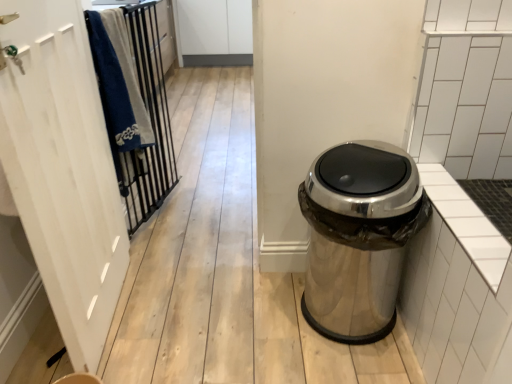
What is the approximate width of metallic black bars at left?

metallic black bars at left is 6.06 inches in width.

The width and height of the screenshot is (512, 384). What do you see at coordinates (134, 106) in the screenshot?
I see `metallic black bars at left` at bounding box center [134, 106].

Where is `white wood screen door at left`? white wood screen door at left is located at coordinates pos(63,170).

Is white wood screen door at left at the back of metallic black bars at left?

No, metallic black bars at left is not facing away from white wood screen door at left.

Would you say metallic black bars at left is a long distance from white wood screen door at left?

No, there isn't a large distance between metallic black bars at left and white wood screen door at left.

What's the angular difference between metallic black bars at left and white wood screen door at left's facing directions?

The facing directions of metallic black bars at left and white wood screen door at left are 15.3 degrees apart.

Considering the positions of point (148, 59) and point (108, 303), is point (148, 59) closer or farther from the camera than point (108, 303)?

Point (148, 59).

Considering the relative positions of white wood screen door at left and metallic black bars at left in the image provided, is white wood screen door at left to the left or to the right of metallic black bars at left?

white wood screen door at left is positioned on metallic black bars at left's left side.

Is point (76, 305) closer or farther from the camera than point (88, 25)?

Point (76, 305) is positioned closer to the camera compared to point (88, 25).

Is white wood screen door at left placed right next to metallic black bars at left?

No, white wood screen door at left is not touching metallic black bars at left.

Considering the sizes of objects white wood screen door at left and metallic black bars at left in the image provided, who is bigger, white wood screen door at left or metallic black bars at left?

With larger size is white wood screen door at left.

Is white wood screen door at left smaller than polished metallic trash can at right?

Actually, white wood screen door at left might be larger than polished metallic trash can at right.

Are white wood screen door at left and polished metallic trash can at right making contact?

They are not placed beside each other.

From a real-world perspective, is white wood screen door at left positioned above or below polished metallic trash can at right?

white wood screen door at left is situated higher than polished metallic trash can at right in the real world.

Is white wood screen door at left facing towards polished metallic trash can at right?

Yes, white wood screen door at left is facing polished metallic trash can at right.

From the picture: Is polished metallic trash can at right not inside white wood screen door at left?

Yes.

Is polished metallic trash can at right facing towards white wood screen door at left?

No.

Which is more to the left, polished metallic trash can at right or white wood screen door at left?

white wood screen door at left.

From a real-world perspective, is polished metallic trash can at right positioned above or below white wood screen door at left?

polished metallic trash can at right is below white wood screen door at left.

Is polished metallic trash can at right beside metallic black bars at left?

No, polished metallic trash can at right is not touching metallic black bars at left.

Where is `closet that appears above the polished metallic trash can at right (from a real-world perspective)`? This screenshot has height=384, width=512. closet that appears above the polished metallic trash can at right (from a real-world perspective) is located at coordinates (134, 106).

In terms of height, does polished metallic trash can at right look taller or shorter compared to metallic black bars at left?

In the image, polished metallic trash can at right appears to be shorter than metallic black bars at left.

Considering the relative positions of metallic black bars at left and polished metallic trash can at right in the image provided, is metallic black bars at left to the left of polished metallic trash can at right from the viewer's perspective?

Indeed, metallic black bars at left is positioned on the left side of polished metallic trash can at right.

Is metallic black bars at left facing towards polished metallic trash can at right?

Yes, metallic black bars at left faces towards polished metallic trash can at right.

What are the coordinates of `closet that is behind the white wood screen door at left` in the screenshot? It's located at (134, 106).

Locate an element on the screen. The width and height of the screenshot is (512, 384). closet above the white wood screen door at left (from the image's perspective) is located at coordinates (134, 106).

When comparing their distances from polished metallic trash can at right, does white wood screen door at left or metallic black bars at left seem further?

metallic black bars at left is positioned further to the anchor polished metallic trash can at right.

Considering their positions, is metallic black bars at left positioned closer to polished metallic trash can at right than white wood screen door at left?

white wood screen door at left lies closer to polished metallic trash can at right than the other object.

Estimate the real-world distances between objects in this image. Which object is further from white wood screen door at left, polished metallic trash can at right or metallic black bars at left?

polished metallic trash can at right lies further to white wood screen door at left than the other object.

Which object lies further to the anchor point white wood screen door at left, metallic black bars at left or polished metallic trash can at right?

The object further to white wood screen door at left is polished metallic trash can at right.

From the image, which object appears to be nearer to metallic black bars at left, polished metallic trash can at right or white wood screen door at left?

white wood screen door at left is positioned closer to the anchor metallic black bars at left.

Considering their positions, is white wood screen door at left positioned closer to metallic black bars at left than polished metallic trash can at right?

Based on the image, white wood screen door at left appears to be nearer to metallic black bars at left.

You are a GUI agent. You are given a task and a screenshot of the screen. Output one action in this format:
    pyautogui.click(x=<x>, y=<y>)
    Task: Click on the closet situated between white wood screen door at left and polished metallic trash can at right from left to right
    
    Given the screenshot: What is the action you would take?
    pyautogui.click(x=134, y=106)